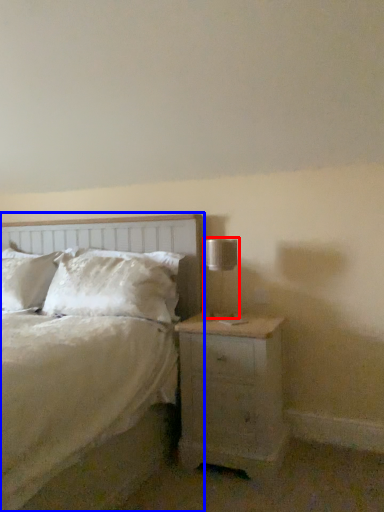
Question: Which object appears closest to the camera in this image, table lamp (highlighted by a red box) or bed (highlighted by a blue box)?

Choices:
 (A) table lamp
 (B) bed

Answer: (B)